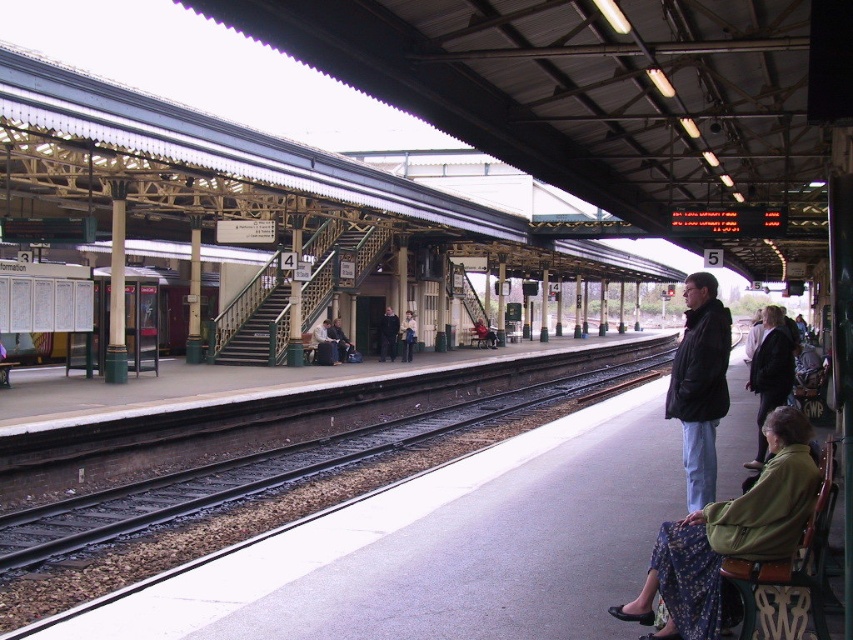
In the scene shown: Who is more forward, (381, 337) or (492, 346)?

Point (381, 337) is in front.

This screenshot has height=640, width=853. Describe the element at coordinates (387, 333) in the screenshot. I see `dark blue jacket at center` at that location.

Does point (386, 348) lie in front of point (474, 321)?

That is True.

The width and height of the screenshot is (853, 640). In order to click on dark blue jacket at center in this screenshot , I will do `click(387, 333)`.

Measure the distance from black matte jacket at lower right to dark blue jacket at center.

The distance of black matte jacket at lower right from dark blue jacket at center is 49.66 feet.

Does black matte jacket at lower right have a greater height compared to dark blue jacket at center?

Correct, black matte jacket at lower right is much taller as dark blue jacket at center.

Where is `black matte jacket at lower right`? Image resolution: width=853 pixels, height=640 pixels. black matte jacket at lower right is located at coordinates (700, 385).

From the picture: Which is above, dark blue jeans at center or matte black jacket at center?

matte black jacket at center

Measure the distance from dark blue jeans at center to matte black jacket at center.

dark blue jeans at center and matte black jacket at center are 50.91 feet apart.

Is point (316, 339) closer to camera compared to point (492, 333)?

Yes, it is.

At what (x,y) coordinates should I click in order to perform the action: click on dark blue jeans at center. Please return your answer as a coordinate pair (x, y). Looking at the image, I should click on (325, 342).